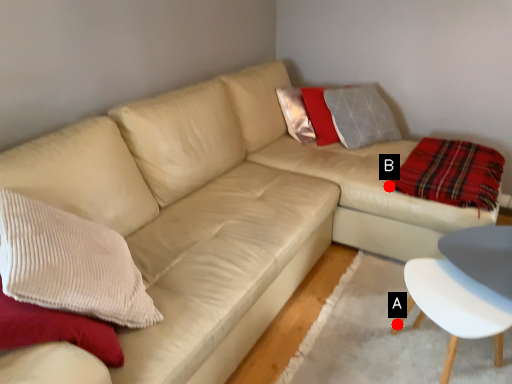
Question: Two points are circled on the image, labeled by A and B beside each circle. Which point appears closest to the camera in this image?

Choices:
 (A) A is closer
 (B) B is closer

Answer: (A)